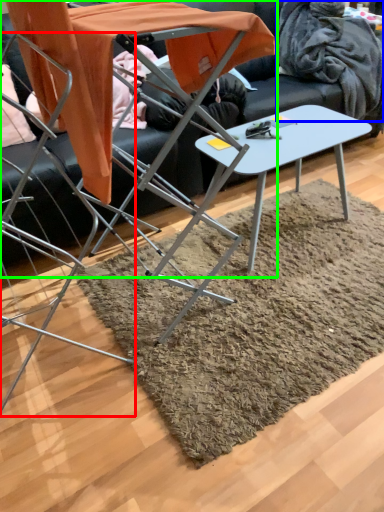
Question: Which object is positioned closest to chair (highlighted by a red box)? Select from blanket (highlighted by a blue box) and table (highlighted by a green box).

Choices:
 (A) blanket
 (B) table

Answer: (B)